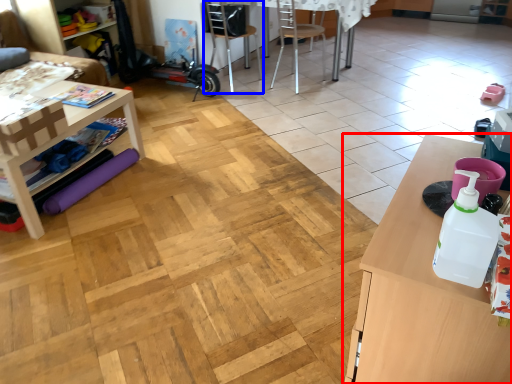
Question: Among these objects, which one is farthest to the camera, table (highlighted by a red box) or chair (highlighted by a blue box)?

Choices:
 (A) table
 (B) chair

Answer: (B)